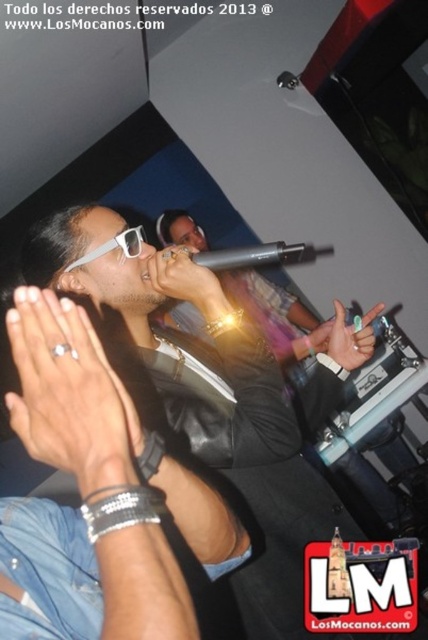
Question: Is satin silver ring at center closer to camera compared to black matte microphone at center?

Choices:
 (A) yes
 (B) no

Answer: (A)

Question: Based on their relative distances, which object is farther from the white plastic sunglasses at center?

Choices:
 (A) silver metallic ring at center
 (B) satin silver ring at center

Answer: (A)

Question: Does satin silver ring at center have a lesser width compared to black matte microphone at center?

Choices:
 (A) no
 (B) yes

Answer: (B)

Question: Observing the image, what is the correct spatial positioning of silver metallic ring at center in reference to satin silver ring at center?

Choices:
 (A) right
 (B) left

Answer: (B)

Question: Which object is positioned farthest from the silver metallic ring at center?

Choices:
 (A) green matte ring at center
 (B) white plastic sunglasses at center

Answer: (A)

Question: Which of the following is the farthest from the observer?

Choices:
 (A) pos(336,346)
 (B) pos(207,280)
 (C) pos(291,244)
 (D) pos(104,244)

Answer: (A)